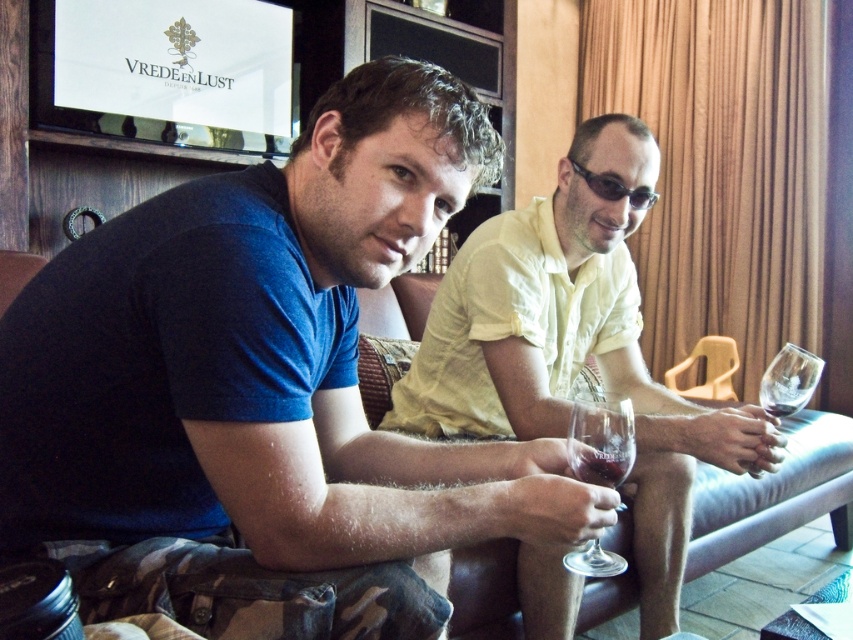
From the picture: You are at a winery and see two people sitting on a couch. One is wearing a dark blue Tshirt and camouflage shorts, the other a light yellow shirt and sunglasses. There is a point marked at coordinate (263, 390). What object is located at that coordinate?

The point at coordinate (263, 390) indicates the blue cotton tshirt at left.